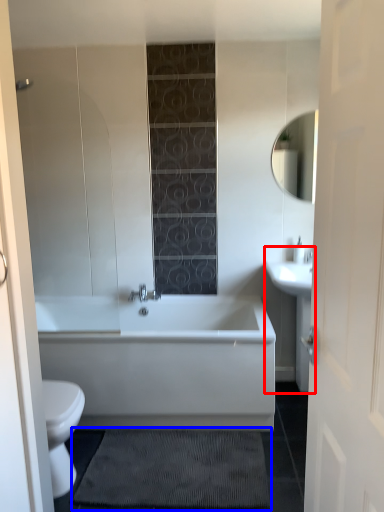
Question: Which object is further to the camera taking this photo, sink (highlighted by a red box) or bath mat (highlighted by a blue box)?

Choices:
 (A) sink
 (B) bath mat

Answer: (A)